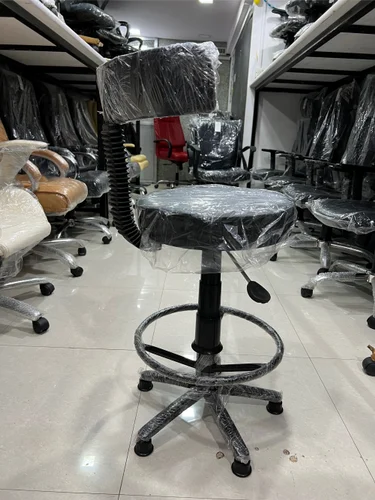
I want to click on dirty floor, so [x=221, y=455], [x=256, y=447], [x=288, y=448], [x=289, y=460].